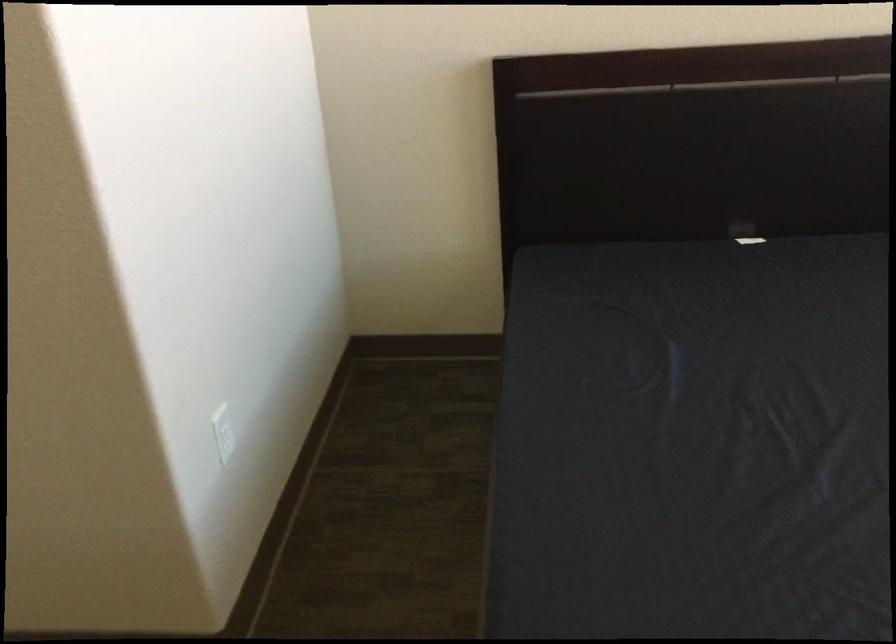
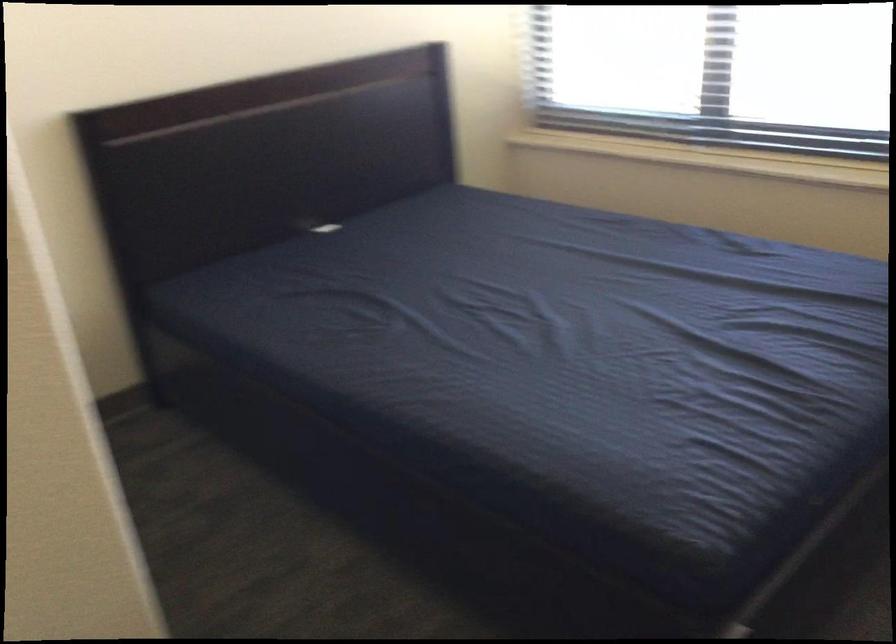
Question: How did the camera likely rotate?

Choices:
 (A) Left
 (B) Right
 (C) Up
 (D) Down

Answer: (B)